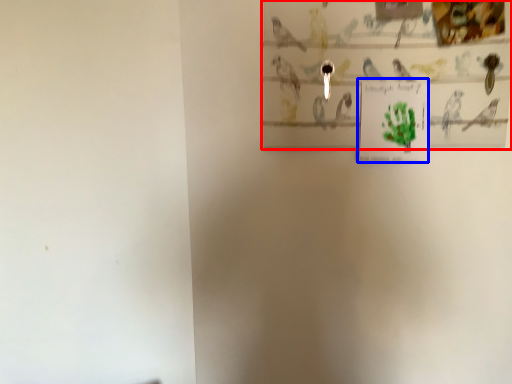
Question: Which of the following is the closest to the observer, picture frame (highlighted by a red box) or postcard (highlighted by a blue box)?

Choices:
 (A) picture frame
 (B) postcard

Answer: (A)